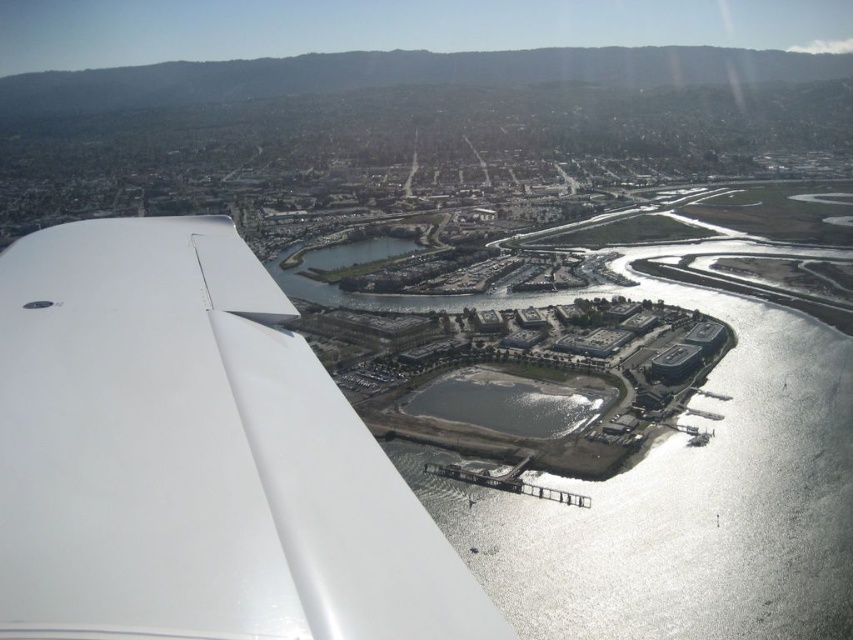
Who is shorter, white glossy wing at left or gray concrete waterway at center?

Standing shorter between the two is gray concrete waterway at center.

Is white glossy wing at left above gray concrete waterway at center?

No.

This screenshot has height=640, width=853. What do you see at coordinates (195, 456) in the screenshot? I see `white glossy wing at left` at bounding box center [195, 456].

The image size is (853, 640). I want to click on white glossy wing at left, so click(195, 456).